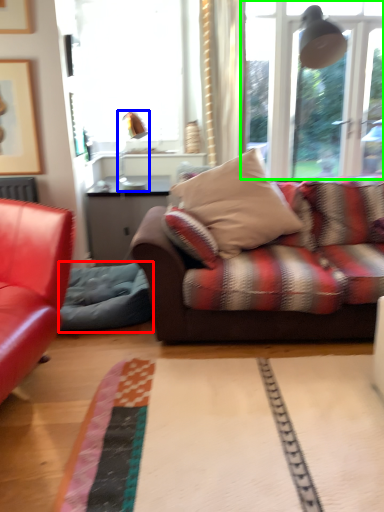
Question: Which is farther away from swivel chair (highlighted by a red box)? lamp (highlighted by a blue box) or window (highlighted by a green box)?

Choices:
 (A) lamp
 (B) window

Answer: (B)